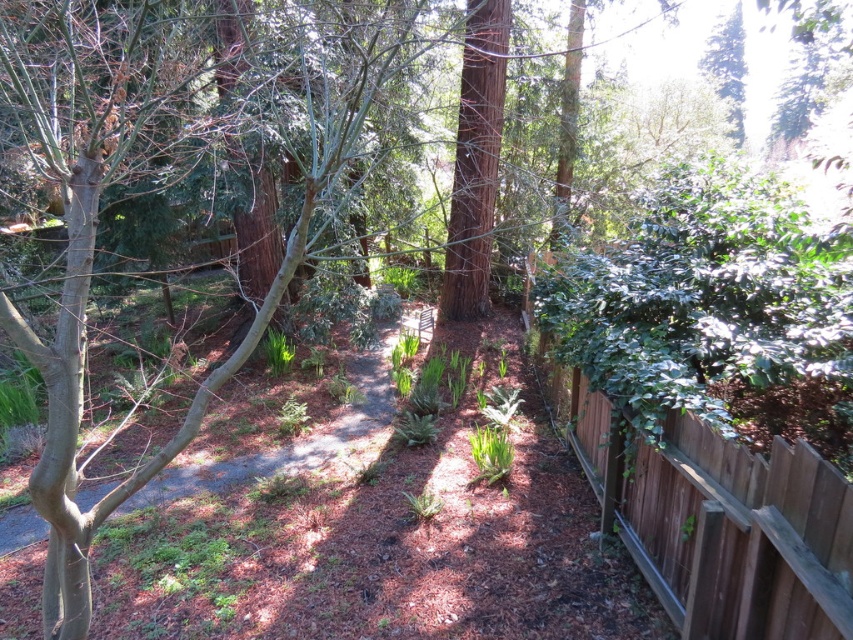
You are designing a garden layout and need to place a 2x4 inch wooden plank between the brown wood fence at right and the brown mulch at center. Which object should the plank be placed closer to to ensure it fits within the available space?

The brown wood fence at right has a lesser width compared to brown mulch at center, so the plank should be placed closer to the brown wood fence at right to ensure it fits within the available space.

You are designing a garden layout and need to ensure that the brown wood fence at right and the brown mulch at center are positioned correctly. Based on their heights, which object should be placed higher in the image?

The brown wood fence at right should be placed higher in the image since it is taller than the brown mulch at center according to the description.